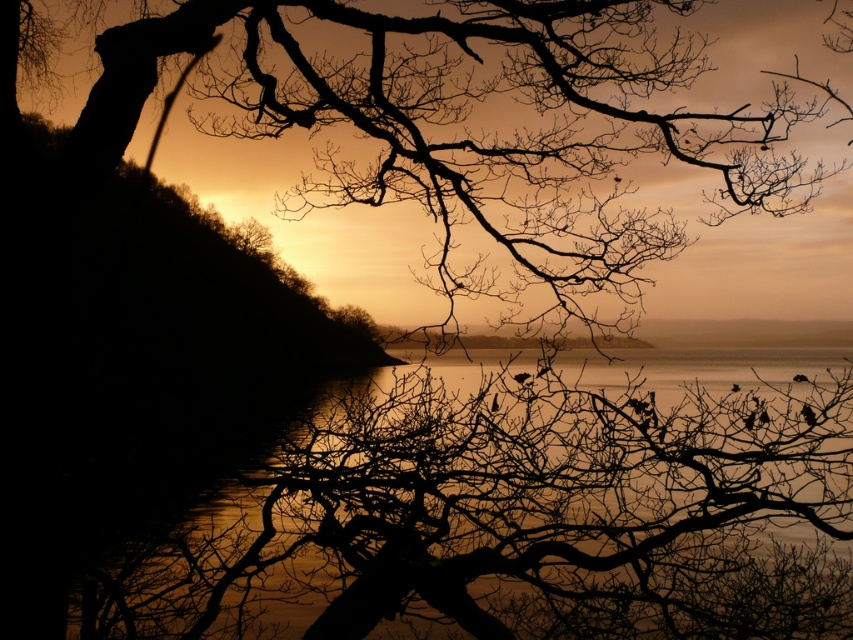
Question: In this image, where is glossy water at center located relative to silhouette bark tree at upper left?

Choices:
 (A) right
 (B) left

Answer: (A)

Question: Does glossy water at center appear on the right side of silhouette bark tree at upper left?

Choices:
 (A) yes
 (B) no

Answer: (A)

Question: Is glossy water at center thinner than silhouette bark tree at upper left?

Choices:
 (A) no
 (B) yes

Answer: (B)